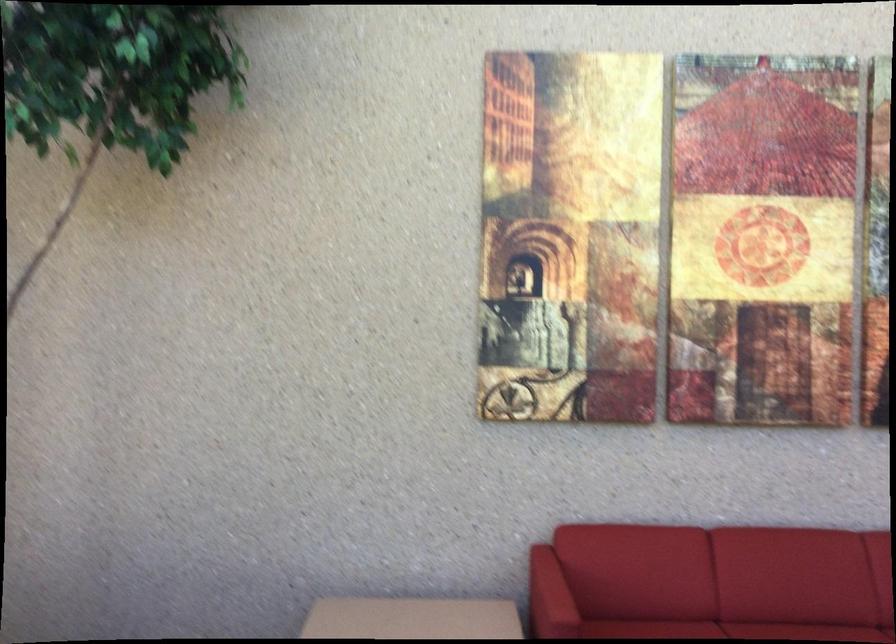
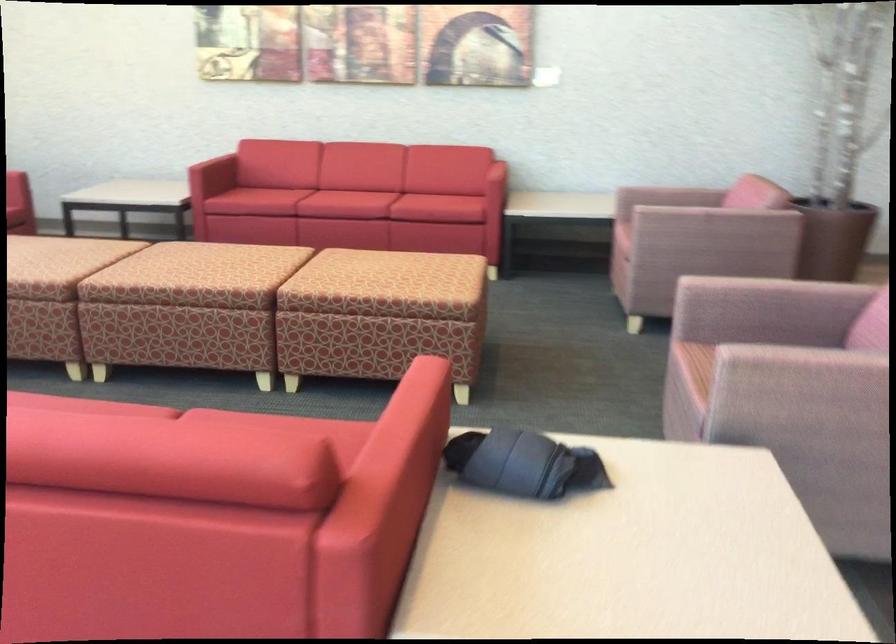
In a continuous first-person perspective shot, in which direction is the camera moving?

The cameraman walked toward right, backward.